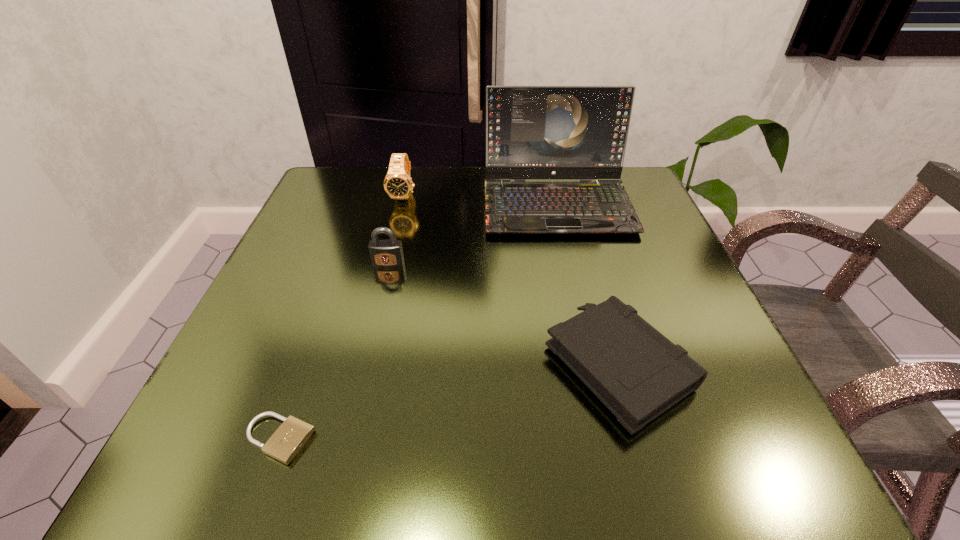
Locate an element on the screen. free location located 0.080m on the left of the second shortest object is located at coordinates (494, 364).

Locate an element on the screen. Image resolution: width=960 pixels, height=540 pixels. vacant space located 0.100m on the back of the leftmost object is located at coordinates (309, 356).

What are the coordinates of `laptop computer present at the far edge` in the screenshot? It's located at (532, 132).

Identify the location of watch that is at the far edge. (398, 184).

This screenshot has width=960, height=540. Find the location of `Bible situated at the near edge`. Bible situated at the near edge is located at coordinates (636, 372).

Where is `padlock located in the near edge section of the desktop`? padlock located in the near edge section of the desktop is located at coordinates (286, 442).

In order to click on object situated at the left edge in this screenshot , I will do `click(286, 442)`.

Find the location of a particular element. The width and height of the screenshot is (960, 540). laptop computer located in the right edge section of the desktop is located at coordinates (532, 132).

Identify the location of Bible at the right edge. (636, 372).

Locate an element on the screen. object present at the near left corner is located at coordinates (286, 442).